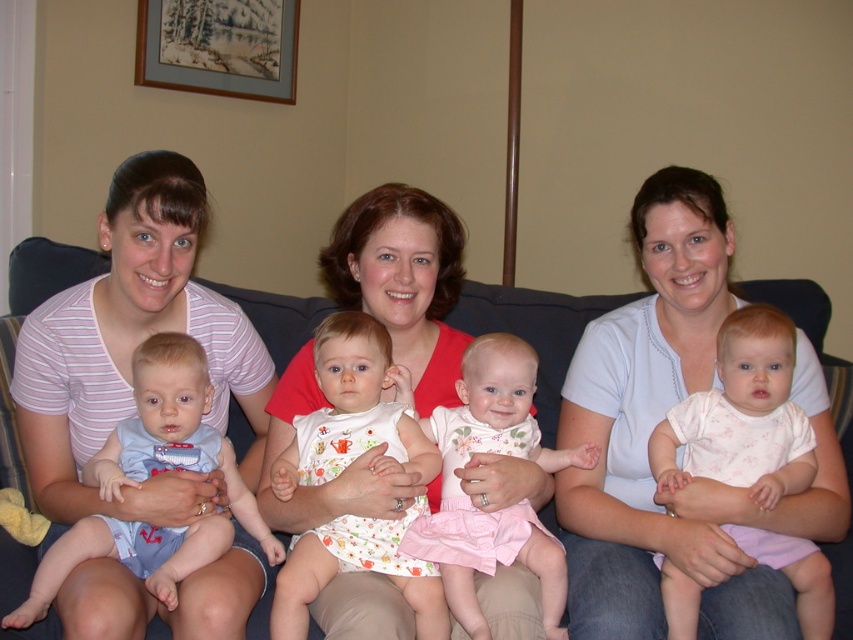
You are a photographer setting up for a family photo. You need to ensure there is enough space between the two babies in the center to avoid overlapping in the shot. The minimum required space between them is 18 inches. Can the white floral onesie at center and the white cotton dress at center be positioned appropriately for the photo?

The distance between the white floral onesie at center and the white cotton dress at center is 20.20 inches, which exceeds the minimum required space of 18 inches. Therefore, they can be positioned appropriately without overlapping in the photo.

You are a photographer trying to capture a closeup of the white floral onesie at center and the blue cotton onesie at left. Since you can only focus on one baby at a time, which baby should you adjust your camera to focus on first if you want to start with the one closer to the center of the image?

You should focus on the white floral onesie at center first because it is positioned to the right of the blue cotton onesie at left, making it closer to the center of the image.

You are standing in the living room and want to place a small plant between the two points marked as point (334, 372) and point (480, 632). Since the plant needs to be placed closer to the viewer, which point should you use as the reference for placement?

You should use point (334, 372) as the reference for placing the plant since it is closer to the viewer compared to point (480, 632).